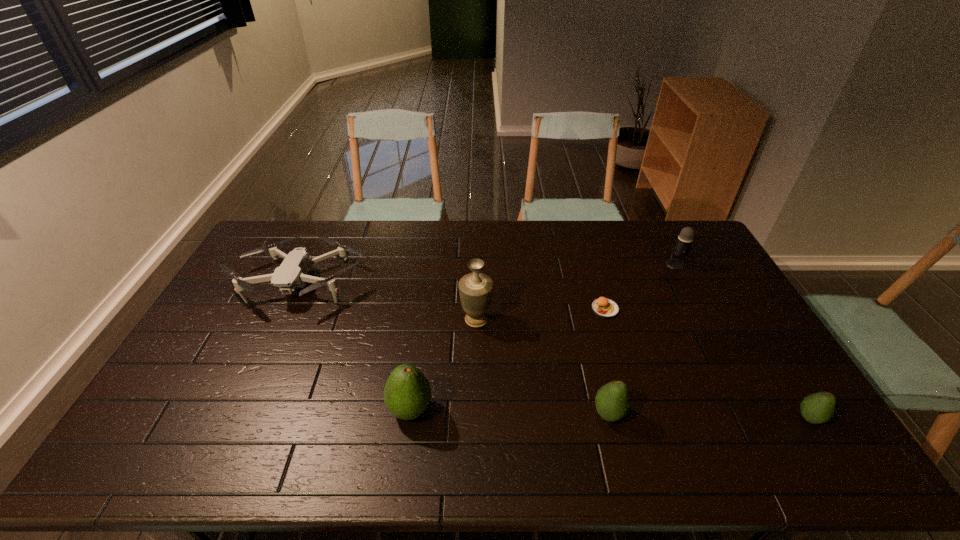
Identify the location of vacant space positioned on the back of the tallest avocado. This screenshot has width=960, height=540. (415, 376).

Where is `free space located 0.100m on the right of the second tallest avocado`? The image size is (960, 540). free space located 0.100m on the right of the second tallest avocado is located at coordinates (663, 414).

This screenshot has width=960, height=540. I want to click on free location located 0.130m on the left of the rightmost object, so click(746, 418).

You are a GUI agent. You are given a task and a screenshot of the screen. Output one action in this format:
    pyautogui.click(x=<x>, y=<y>)
    Task: Click on the vacant area situated on the front of the microphone
    Image resolution: width=960 pixels, height=540 pixels.
    Given the screenshot: What is the action you would take?
    pyautogui.click(x=688, y=289)

Where is `free space located on the back of the shortest object`? This screenshot has width=960, height=540. free space located on the back of the shortest object is located at coordinates (588, 251).

Where is `blank area located 0.300m on the back of the fifth object from right to left`? This screenshot has height=540, width=960. blank area located 0.300m on the back of the fifth object from right to left is located at coordinates (477, 251).

The width and height of the screenshot is (960, 540). Find the location of `vacant area located 0.360m with a camera at the front of the leftmost object`. vacant area located 0.360m with a camera at the front of the leftmost object is located at coordinates (233, 423).

Identify the location of object present at the far edge. (292, 273).

Locate an element on the screen. object that is at the left edge is located at coordinates (292, 273).

In order to click on avocado at the right edge in this screenshot , I will do `click(817, 408)`.